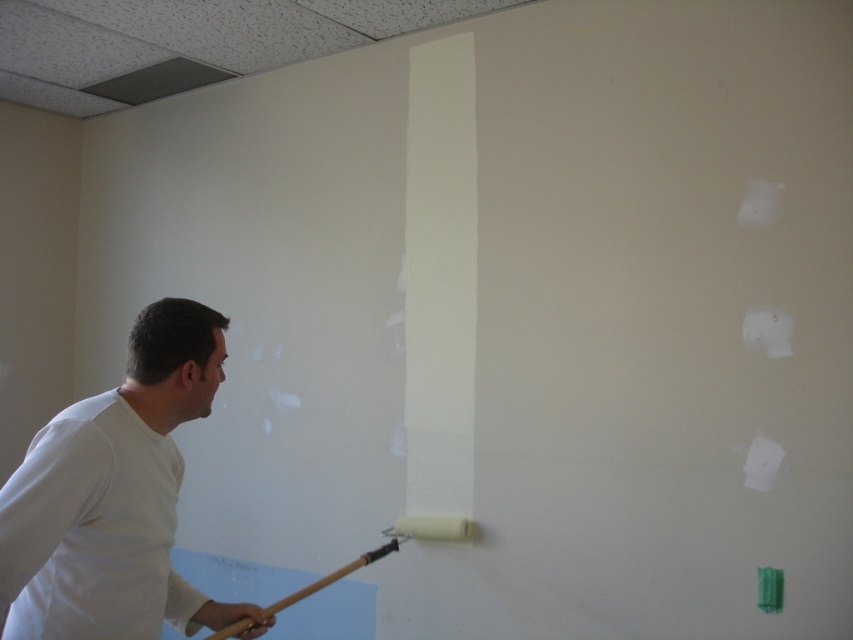
Does white matte shirt at left appear over wooden paintbrush at lower left?

Indeed, white matte shirt at left is positioned over wooden paintbrush at lower left.

Describe the element at coordinates (115, 497) in the screenshot. I see `white matte shirt at left` at that location.

Is point (10, 602) farther from camera compared to point (265, 616)?

No, it is not.

Locate an element on the screen. white matte shirt at left is located at coordinates (115, 497).